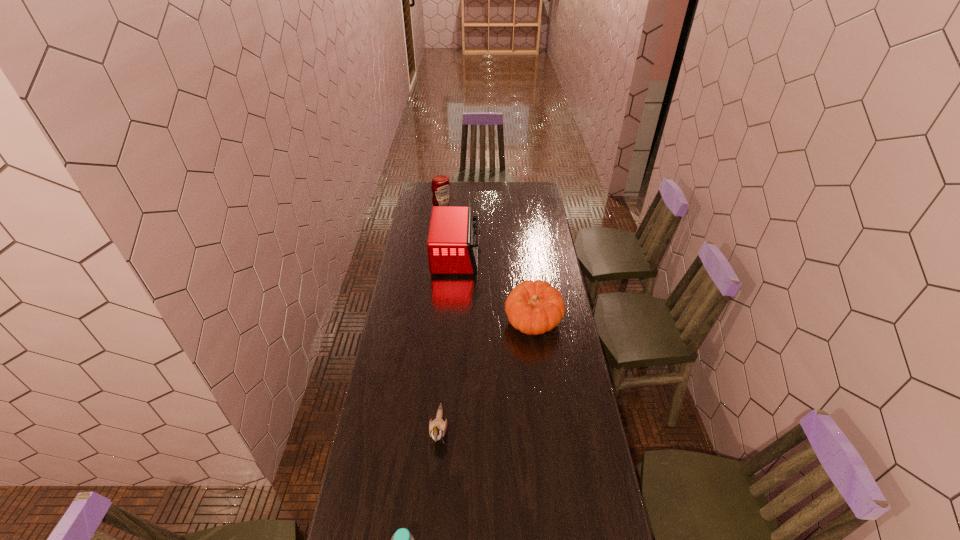
I want to click on toaster oven that is at the left edge, so click(452, 245).

The image size is (960, 540). In order to click on object at the right edge in this screenshot , I will do coord(536,307).

At what (x,y) coordinates should I click in order to perform the action: click on vacant space at the far edge of the desktop. Please return your answer as a coordinate pair (x, y). The width and height of the screenshot is (960, 540). Looking at the image, I should click on (489, 194).

Locate an element on the screen. The image size is (960, 540). free space at the left edge is located at coordinates (392, 480).

At what (x,y) coordinates should I click in order to perform the action: click on vacant space at the right edge of the desktop. Please return your answer as a coordinate pair (x, y). The width and height of the screenshot is (960, 540). Looking at the image, I should click on (550, 272).

In order to click on vacant space at the far right corner in this screenshot , I will do `click(533, 194)`.

The image size is (960, 540). I want to click on free point between the bird and the condiment, so click(x=441, y=321).

The width and height of the screenshot is (960, 540). I want to click on unoccupied area between the pumpkin and the condiment, so click(x=488, y=267).

This screenshot has width=960, height=540. Find the location of `free spot between the second nearest object and the toaster oven`. free spot between the second nearest object and the toaster oven is located at coordinates (448, 343).

Find the location of a particular element. This screenshot has height=540, width=960. blank region between the third farthest object and the bird is located at coordinates (486, 376).